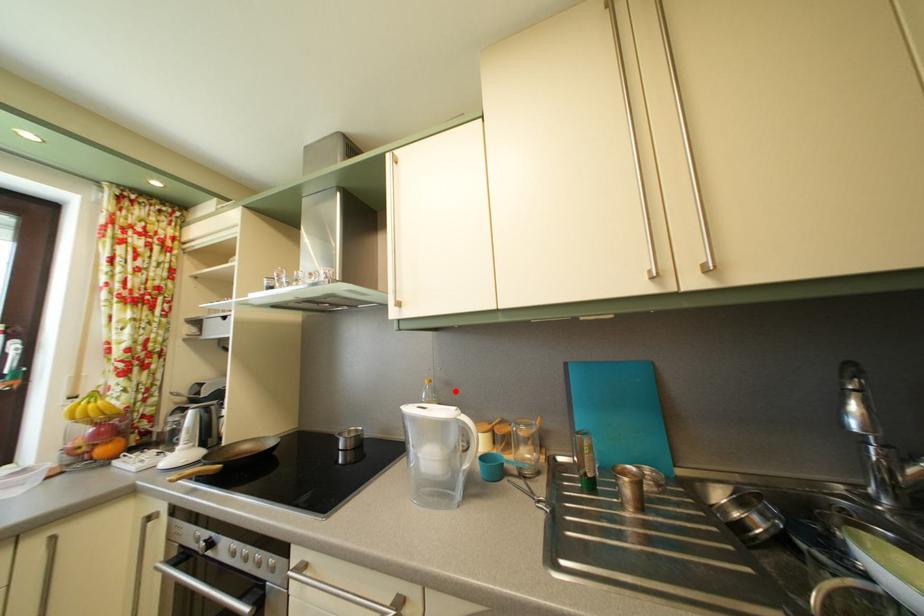
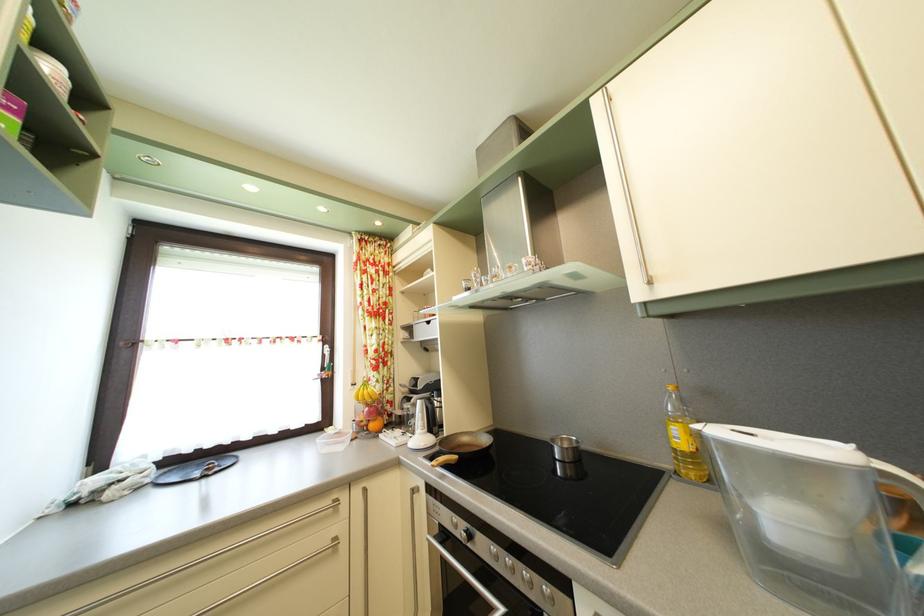
Locate, in the second image, the point that corresponds to the highlighted location in the first image.

(715, 400)